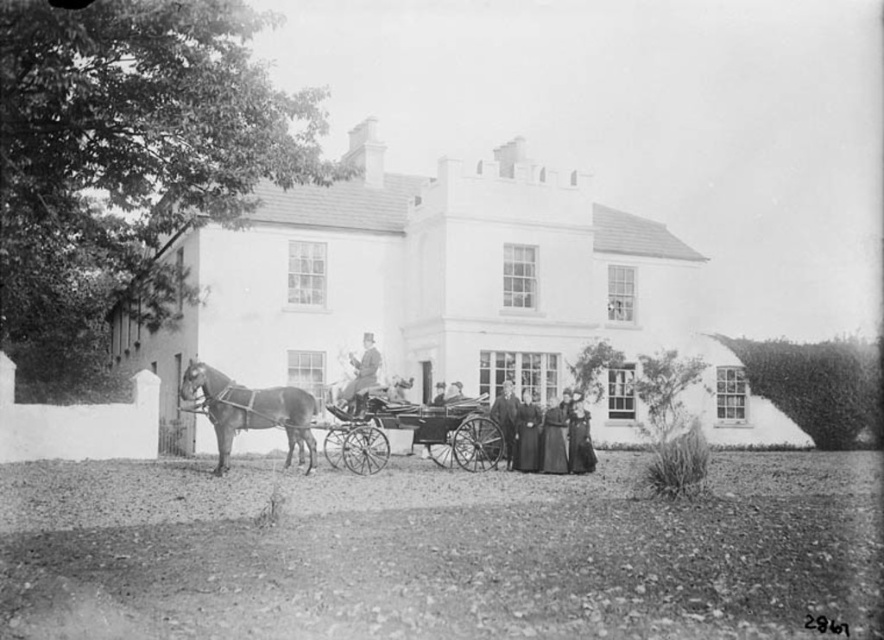
Question: Among these objects, which one is nearest to the camera?

Choices:
 (A) dark wool coat at center
 (B) wooden polished cart at center
 (C) smooth leather hat at center
 (D) smooth dark fabric coat at center

Answer: (B)

Question: Does dark wool coat at center have a larger size compared to smooth leather hat at center?

Choices:
 (A) yes
 (B) no

Answer: (A)

Question: Which point is farther to the camera?

Choices:
 (A) (503, 422)
 (B) (229, 406)
 (C) (349, 384)

Answer: (A)

Question: In this image, where is wooden polished cart at center located relative to dark wool coat at center?

Choices:
 (A) below
 (B) above

Answer: (B)

Question: Does dark wool coat at center have a smaller size compared to dark brown fabric coat at center?

Choices:
 (A) no
 (B) yes

Answer: (B)

Question: Which of the following is the farthest from the observer?

Choices:
 (A) (371, 381)
 (B) (505, 440)

Answer: (B)